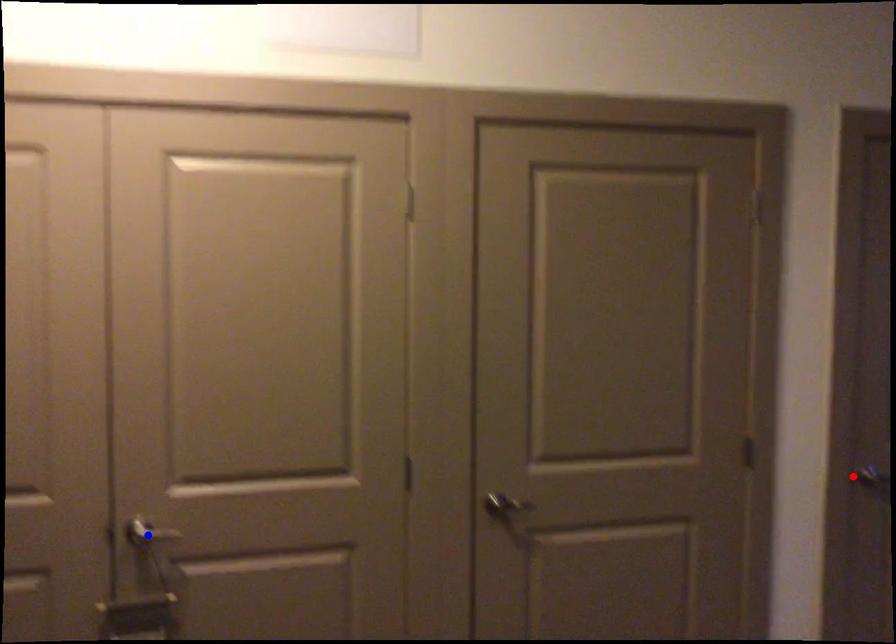
Question: Which of the two points in the image is closer to the camera?

Choices:
 (A) Blue point is closer.
 (B) Red point is closer.

Answer: (A)